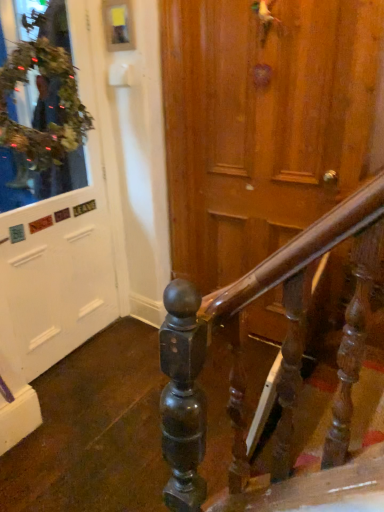
This screenshot has width=384, height=512. What do you see at coordinates (62, 239) in the screenshot?
I see `white matte door at left` at bounding box center [62, 239].

Locate an element on the screen. Image resolution: width=384 pixels, height=512 pixels. white matte door at left is located at coordinates (62, 239).

The image size is (384, 512). What do you see at coordinates (42, 115) in the screenshot?
I see `green leafy wreath at upper left` at bounding box center [42, 115].

Where is `green leafy wreath at upper left`? This screenshot has width=384, height=512. green leafy wreath at upper left is located at coordinates (42, 115).

You are a GUI agent. You are given a task and a screenshot of the screen. Output one action in this format:
    pyautogui.click(x=<x>, y=<y>)
    Task: Click on the white matte door at left
    This screenshot has width=384, height=512.
    Given the screenshot: What is the action you would take?
    pyautogui.click(x=62, y=239)

Which object is positioned more to the left, green leafy wreath at upper left or white matte door at left?

white matte door at left.

Is green leafy wreath at upper left in front of or behind white matte door at left in the image?

green leafy wreath at upper left is behind white matte door at left.

Which is less distant, (9, 55) or (57, 312)?

The point (9, 55) is more forward.

From the image's perspective, between green leafy wreath at upper left and white matte door at left, who is located below?

white matte door at left.

From a real-world perspective, which is physically below, green leafy wreath at upper left or white matte door at left?

From a 3D spatial view, white matte door at left is below.

Can you confirm if green leafy wreath at upper left is thinner than white matte door at left?

No, green leafy wreath at upper left is not thinner than white matte door at left.

Does green leafy wreath at upper left have a greater height compared to white matte door at left?

Incorrect, the height of green leafy wreath at upper left is not larger of that of white matte door at left.

Considering the relative sizes of green leafy wreath at upper left and white matte door at left in the image provided, is green leafy wreath at upper left smaller than white matte door at left?

Yes.

Is green leafy wreath at upper left inside the boundaries of white matte door at left, or outside?

The correct answer is: outside.

Is green leafy wreath at upper left directly adjacent to white matte door at left?

They are not placed beside each other.

Is green leafy wreath at upper left looking in the opposite direction of white matte door at left?

Yes, green leafy wreath at upper left is positioned with its back facing white matte door at left.

How many degrees apart are the facing directions of green leafy wreath at upper left and white matte door at left?

The angular difference between green leafy wreath at upper left and white matte door at left is 2.05 degrees.

You are a GUI agent. You are given a task and a screenshot of the screen. Output one action in this format:
    pyautogui.click(x=<x>, y=<y>)
    Task: Click on the door that is below the green leafy wreath at upper left (from the image's perspective)
    This screenshot has width=384, height=512.
    Given the screenshot: What is the action you would take?
    pyautogui.click(x=62, y=239)

Considering the relative positions of white matte door at left and green leafy wreath at upper left in the image provided, is white matte door at left to the right of green leafy wreath at upper left from the viewer's perspective?

Incorrect, white matte door at left is not on the right side of green leafy wreath at upper left.

Is white matte door at left in front of green leafy wreath at upper left?

Yes, white matte door at left is closer to the viewer.

Is point (26, 272) positioned in front of point (69, 157)?

Yes, it is.

From the image's perspective, who appears lower, white matte door at left or green leafy wreath at upper left?

white matte door at left, from the image's perspective.

From a real-world perspective, is white matte door at left above or below green leafy wreath at upper left?

Clearly, from a real-world perspective, white matte door at left is below green leafy wreath at upper left.

Considering the sizes of white matte door at left and green leafy wreath at upper left in the image, is white matte door at left wider or thinner than green leafy wreath at upper left?

Clearly, white matte door at left has less width compared to green leafy wreath at upper left.

Considering the sizes of objects white matte door at left and green leafy wreath at upper left in the image provided, who is taller, white matte door at left or green leafy wreath at upper left?

With more height is white matte door at left.

From the picture: Which of these two, white matte door at left or green leafy wreath at upper left, is bigger?

white matte door at left is bigger.

Consider the image. Is green leafy wreath at upper left located within white matte door at left?

No, green leafy wreath at upper left is not surrounded by white matte door at left.

Is there a large distance between white matte door at left and green leafy wreath at upper left?

No, white matte door at left is in close proximity to green leafy wreath at upper left.

Does white matte door at left turn towards green leafy wreath at upper left?

Yes, white matte door at left is turned towards green leafy wreath at upper left.

At what (x,y) coordinates should I click in order to perform the action: click on door on the left of the green leafy wreath at upper left. Please return your answer as a coordinate pair (x, y). This screenshot has width=384, height=512. Looking at the image, I should click on tap(62, 239).

The height and width of the screenshot is (512, 384). Identify the location of door in front of the green leafy wreath at upper left. (62, 239).

Find the location of `shop window that is above the white matte door at left (from the image's perspective)`. shop window that is above the white matte door at left (from the image's perspective) is located at coordinates (42, 115).